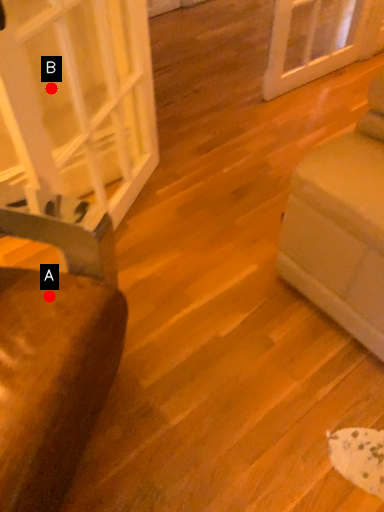
Question: Two points are circled on the image, labeled by A and B beside each circle. Which point is farther from the camera taking this photo?

Choices:
 (A) A is further
 (B) B is further

Answer: (B)